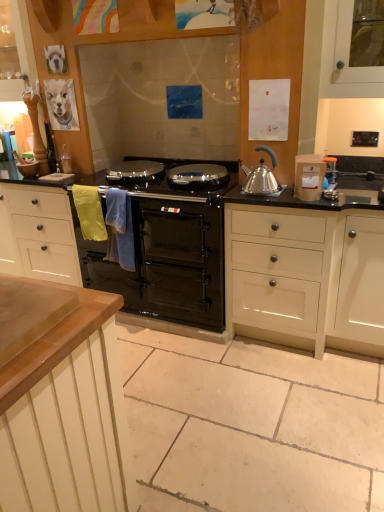
Question: From a real-world perspective, relative to black glass oven at center, is wooden cabinet at upper left, which is counted as the 2th cabinetry, starting from the bottom, vertically above or below?

Choices:
 (A) above
 (B) below

Answer: (A)

Question: From the image's perspective, is wooden cabinet at upper left, which is counted as the 2th cabinetry, starting from the bottom, above or below black glass oven at center?

Choices:
 (A) below
 (B) above

Answer: (B)

Question: Which object is the closest to the satin silver kettle at right?

Choices:
 (A) black glass oven at center
 (B) white matte container at right
 (C) white matte cabinet at right, which ranks as the 2th cabinetry in top-to-bottom order
 (D) wooden cabinet at upper left, which is the first cabinetry in top-to-bottom order

Answer: (B)

Question: Estimate the real-world distances between objects in this image. Which object is farther from the white matte cabinet at right, the 2th cabinetry positioned from the left?

Choices:
 (A) white matte container at right
 (B) wooden cabinet at upper left, which is counted as the 2th cabinetry, starting from the bottom
 (C) black glass oven at center
 (D) satin silver kettle at right

Answer: (B)